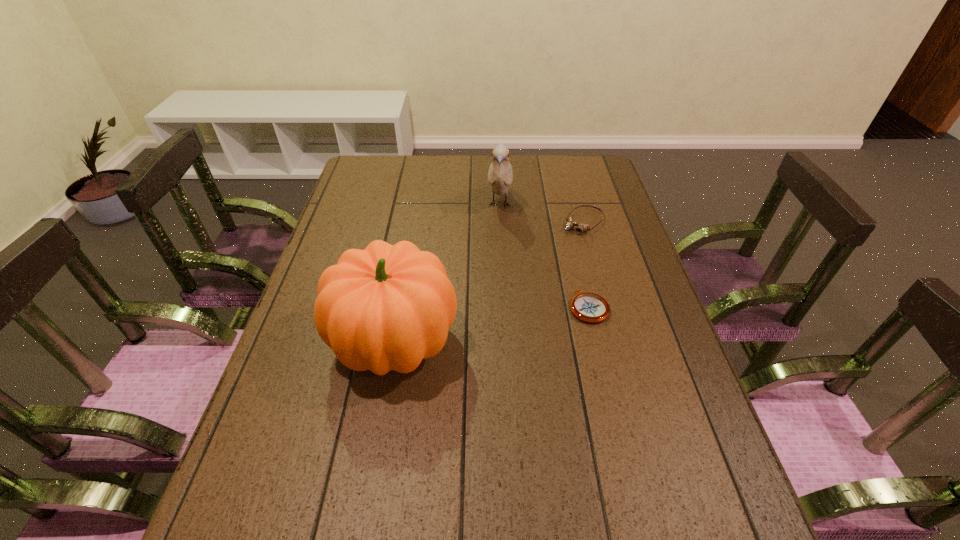
Identify the location of free space between the compass and the bird. This screenshot has width=960, height=540. (544, 256).

Select which object is the closest to the compass. Please provide its 2D coordinates. Your answer should be formatted as a tuple, i.e. [(x, y)], where the tuple contains the x and y coordinates of a point satisfying the conditions above.

[(570, 224)]

Choose which object is the nearest neighbor to the leftmost object. Please provide its 2D coordinates. Your answer should be formatted as a tuple, i.e. [(x, y)], where the tuple contains the x and y coordinates of a point satisfying the conditions above.

[(590, 307)]

At what (x,y) coordinates should I click in order to perform the action: click on free space in the image that satisfies the following two spatial constraints: 1. on the back side of the compass; 2. on the left side of the goggles. Please return your answer as a coordinate pair (x, y). This screenshot has height=540, width=960. Looking at the image, I should click on (568, 222).

The width and height of the screenshot is (960, 540). Find the location of `vacant area that satisfies the following two spatial constraints: 1. on the front side of the third object from right to left; 2. on the left side of the shortest object`. vacant area that satisfies the following two spatial constraints: 1. on the front side of the third object from right to left; 2. on the left side of the shortest object is located at coordinates (505, 307).

Image resolution: width=960 pixels, height=540 pixels. In order to click on free location that satisfies the following two spatial constraints: 1. on the back side of the shortest object; 2. on the right side of the goggles in this screenshot , I will do `click(568, 222)`.

This screenshot has height=540, width=960. I want to click on vacant area in the image that satisfies the following two spatial constraints: 1. on the back side of the third tallest object; 2. on the right side of the compass, so click(x=568, y=222).

Image resolution: width=960 pixels, height=540 pixels. I want to click on vacant space that satisfies the following two spatial constraints: 1. on the front side of the compass; 2. on the right side of the bird, so click(505, 307).